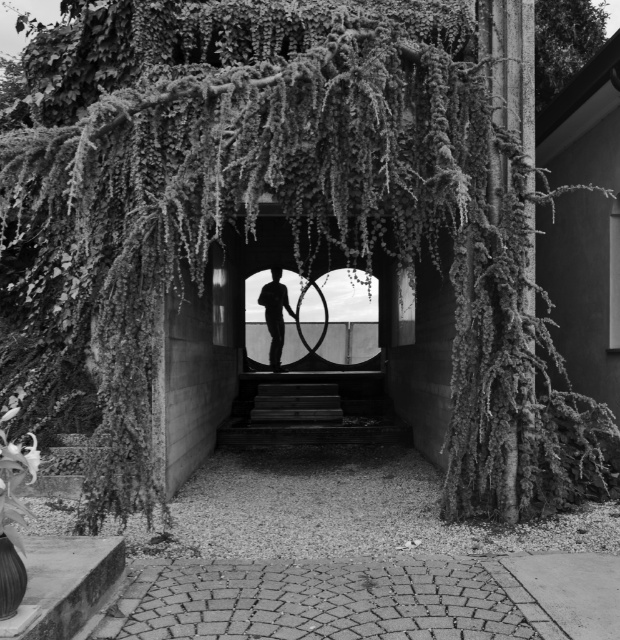
Question: Which point is farther to the camera?

Choices:
 (A) smooth glass door at center
 (B) green leafy tree at upper right

Answer: (A)

Question: Where is green leafy tree at upper right located in relation to silhouette figure at center in the image?

Choices:
 (A) right
 (B) left

Answer: (A)

Question: Which point is farther to the camera?

Choices:
 (A) (267, 324)
 (B) (303, 384)
 (C) (350, 400)

Answer: (A)

Question: Can you confirm if smooth glass door at center is positioned to the left of silhouette figure at center?

Choices:
 (A) yes
 (B) no

Answer: (B)

Question: Which object appears farthest from the camera in this image?

Choices:
 (A) smooth glass door at center
 (B) smooth wooden stairs at center

Answer: (B)

Question: Is green leafy tree at upper right smaller than smooth wooden stairs at center?

Choices:
 (A) yes
 (B) no

Answer: (B)